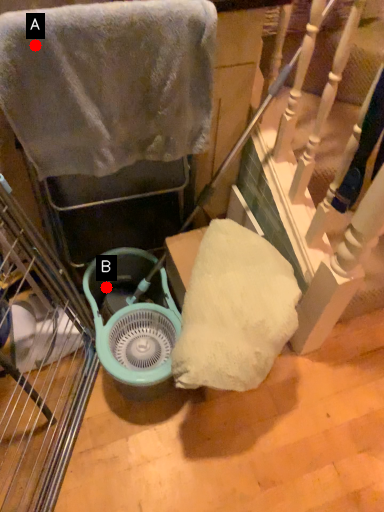
Question: Two points are circled on the image, labeled by A and B beside each circle. Which point is closer to the camera?

Choices:
 (A) A is closer
 (B) B is closer

Answer: (A)